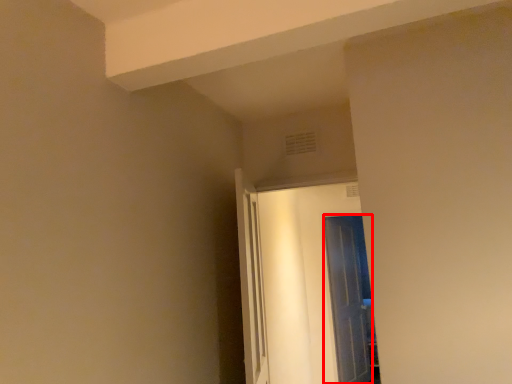
Question: From the image, what is the correct spatial relationship of door (annotated by the red box) in relation to door?

Choices:
 (A) left
 (B) right

Answer: (B)